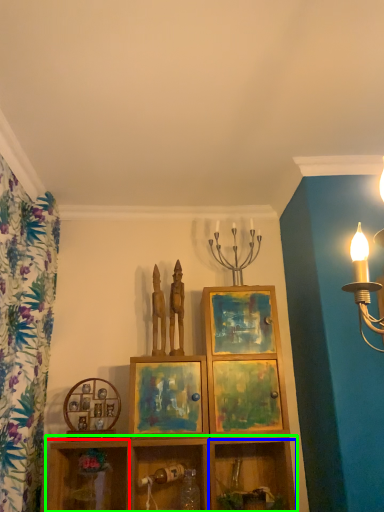
Question: Based on their relative distances, which object is farther from shelf (highlighted by a red box)? Choose from shelf (highlighted by a blue box) and shelf (highlighted by a green box).

Choices:
 (A) shelf
 (B) shelf

Answer: (A)